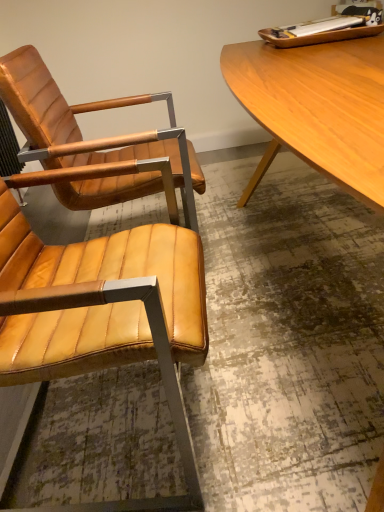
Question: Is matte leather chair at left, positioned as the first chair in front-to-back order, to the left or to the right of light brown wood desk at upper right in the image?

Choices:
 (A) left
 (B) right

Answer: (A)

Question: Looking at their shapes, would you say matte leather chair at left, placed as the second chair when sorted from back to front, is wider or thinner than light brown wood desk at upper right?

Choices:
 (A) wide
 (B) thin

Answer: (B)

Question: Estimate the real-world distances between objects in this image. Which object is farther from the matte leather chair at left, the 2th chair in the front-to-back sequence?

Choices:
 (A) matte leather chair at left, placed as the second chair when sorted from back to front
 (B) light brown wood desk at upper right

Answer: (B)

Question: Estimate the real-world distances between objects in this image. Which object is farther from the matte leather chair at left, positioned as the first chair in front-to-back order?

Choices:
 (A) light brown wood desk at upper right
 (B) matte leather chair at left, the 1th chair positioned from the back

Answer: (A)